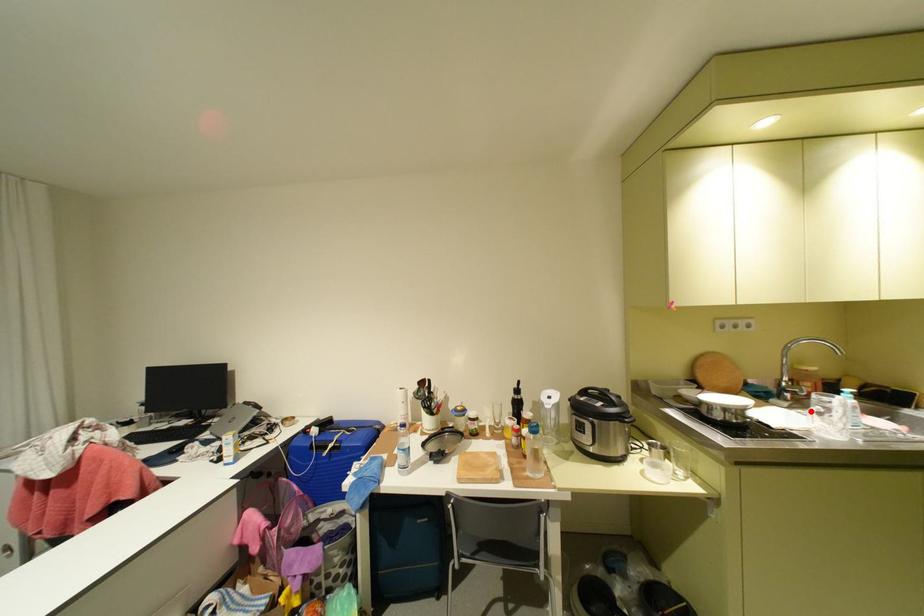
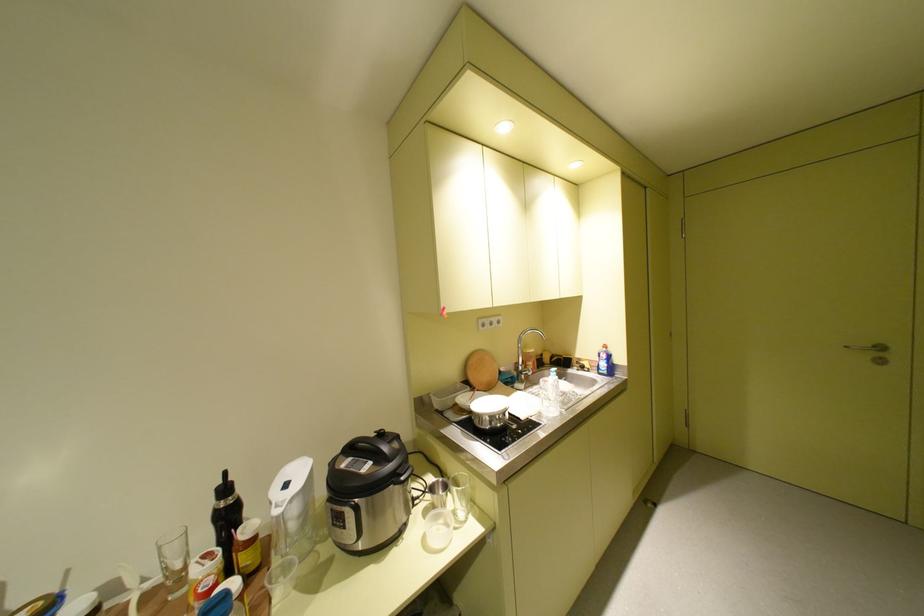
Locate, in the second image, the point that corresponds to the highlighted location in the first image.

(541, 390)